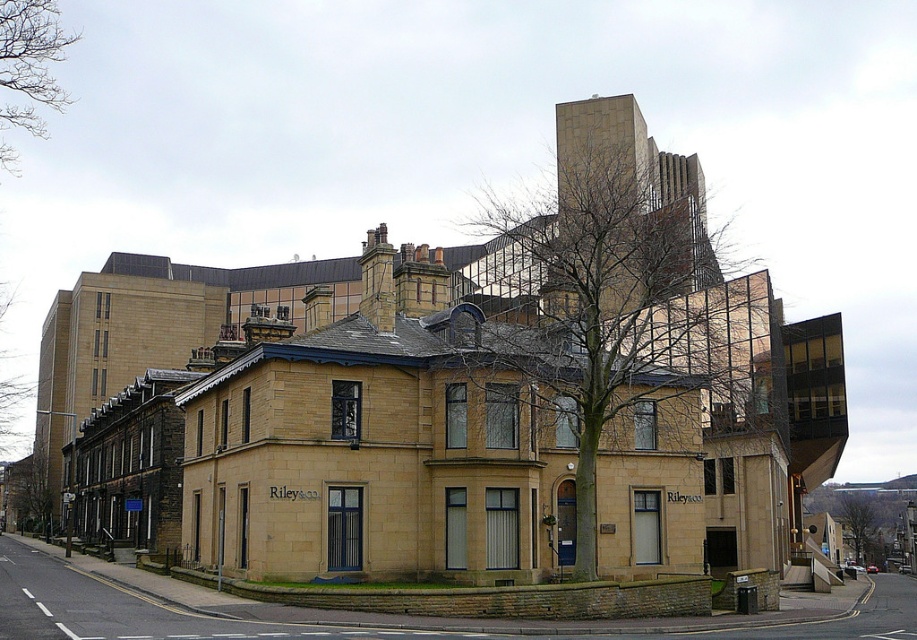
You are an urban planner reviewing this area. You observe the bare branches at center and the bare branches at upper left in the scene. Which of these two groups of branches takes up more space in the image?

The bare branches at upper left occupies more space than the bare branches at center.